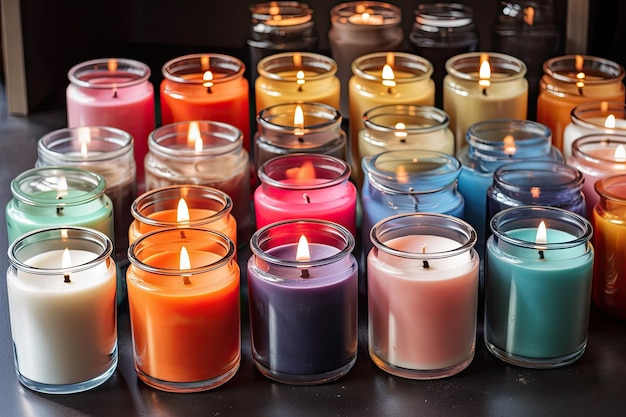
You are a GUI agent. You are given a task and a screenshot of the screen. Output one action in this format:
    pyautogui.click(x=<x>, y=<y>)
    Task: Click on the reflection of candles in table
    This screenshot has width=626, height=417.
    Given the screenshot: What is the action you would take?
    pyautogui.click(x=46, y=406), pyautogui.click(x=180, y=403), pyautogui.click(x=299, y=394), pyautogui.click(x=399, y=393), pyautogui.click(x=521, y=396), pyautogui.click(x=608, y=351)